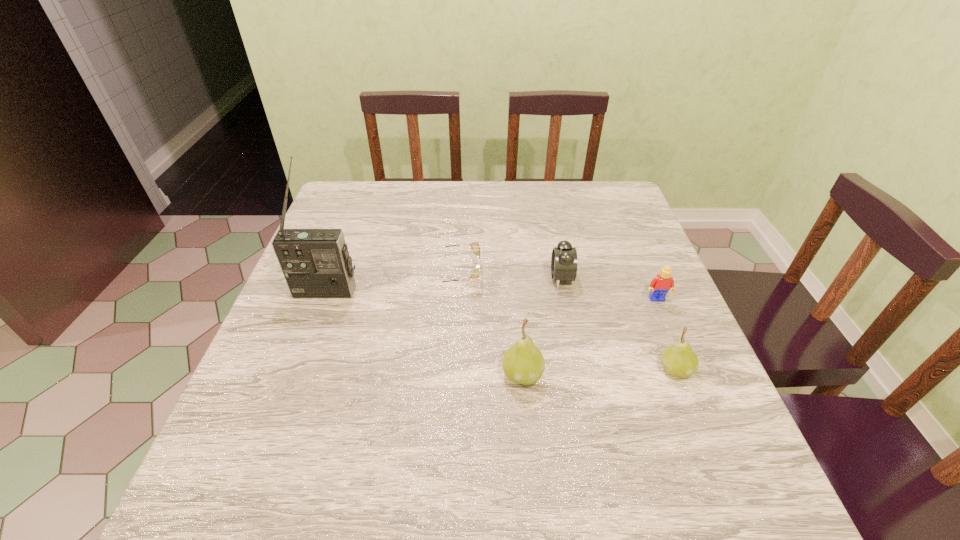
This screenshot has width=960, height=540. I want to click on vacant space in between the third object from right to left and the shorter pear, so click(618, 323).

Find the location of a particular element. vacant point located between the shortest object and the right pear is located at coordinates (566, 322).

Where is `vacant space that's between the left pear and the Lego`? This screenshot has width=960, height=540. vacant space that's between the left pear and the Lego is located at coordinates (589, 336).

Where is `vacant point located between the leftmost object and the sunglasses`? vacant point located between the leftmost object and the sunglasses is located at coordinates (391, 283).

This screenshot has width=960, height=540. Find the location of `blank region between the alarm clock and the shorter pear`. blank region between the alarm clock and the shorter pear is located at coordinates (618, 323).

Where is `empty space between the Lego and the shorter pear`? empty space between the Lego and the shorter pear is located at coordinates (666, 334).

You are a GUI agent. You are given a task and a screenshot of the screen. Output one action in this format:
    pyautogui.click(x=<x>, y=<y>)
    Task: Click on the free spot between the shorter pear and the alarm clock
    
    Given the screenshot: What is the action you would take?
    pyautogui.click(x=618, y=323)

Locate an element on the screen. object that stands as the fifth closest to the fourth object from left to right is located at coordinates (316, 264).

The image size is (960, 540). In order to click on object that stands as the second closest to the shortest object in this screenshot , I will do `click(564, 258)`.

This screenshot has height=540, width=960. Find the location of `free space in the image that satisfies the following two spatial constraints: 1. on the display of the shorter pear; 2. on the left side of the radio receiver`. free space in the image that satisfies the following two spatial constraints: 1. on the display of the shorter pear; 2. on the left side of the radio receiver is located at coordinates (297, 369).